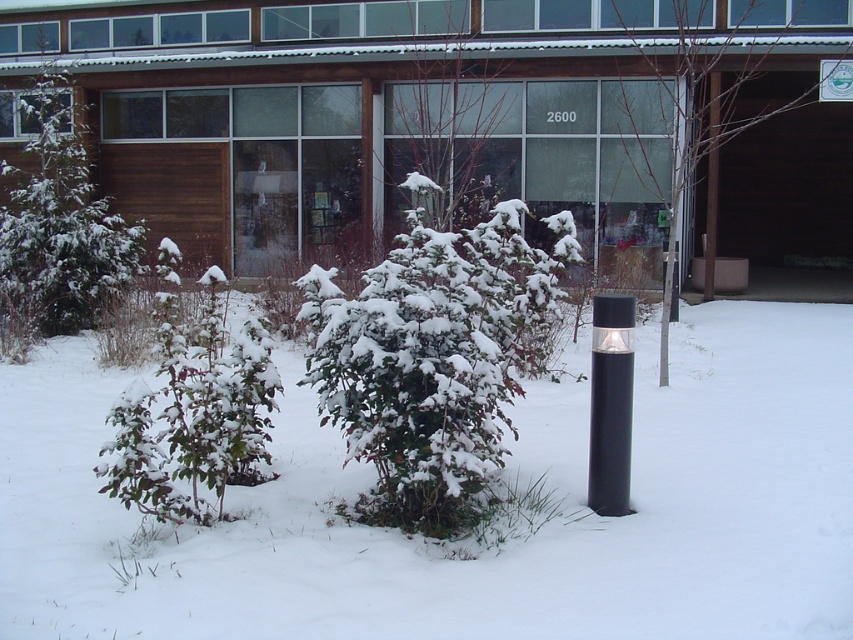
Question: Which of the following is the farthest from the observer?

Choices:
 (A) green matte tree at upper center
 (B) bare branches at center
 (C) snow-covered branches at center
 (D) white matte snow at center

Answer: (C)

Question: Which of the following is the closest to the observer?

Choices:
 (A) click(x=476, y=180)
 (B) click(x=386, y=292)

Answer: (B)

Question: Does snow-covered bush at center have a lesser width compared to green matte bush at left?

Choices:
 (A) yes
 (B) no

Answer: (B)

Question: Does bare branches at center have a larger size compared to snow-covered branches at center?

Choices:
 (A) yes
 (B) no

Answer: (A)

Question: Which of the following is the closest to the observer?

Choices:
 (A) (689, 12)
 (B) (364, 502)
 (C) (503, 166)

Answer: (B)

Question: Is snow-covered bush at center wider than snow-covered branches at center?

Choices:
 (A) no
 (B) yes

Answer: (A)